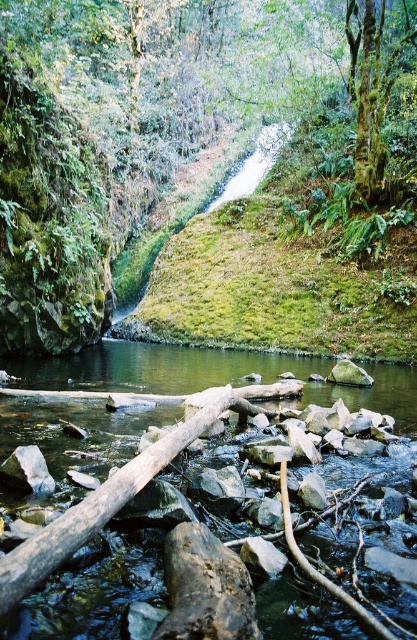
You are a photographer standing at the edge of the riverbed in the scene. You want to take a photo that includes both the point at coordinates point (120,532) and point (47,484). Which point will appear larger in the photo?

Point (120,532) will appear larger in the photo because it is closer to the camera than point (47,484).

You are a hiker carrying a 2.5 meter long wooden plank. You want to cross the smooth brown river at center. There is a gray rock at center nearby. Can you place the plank between them to make a bridge?

The distance between the smooth brown river at center and the gray rock at center is 4.16 meters. Since the plank is only 2.5 meters long, it is not long enough to span the gap between them. You will need a longer plank or an additional support to create a bridge.

You are a hiker trying to cross the river. You see the smooth brown river at center and the gray rock at center. Which object is located below the other?

The smooth brown river at center is positioned under the gray rock at center, so the river is below the rock.